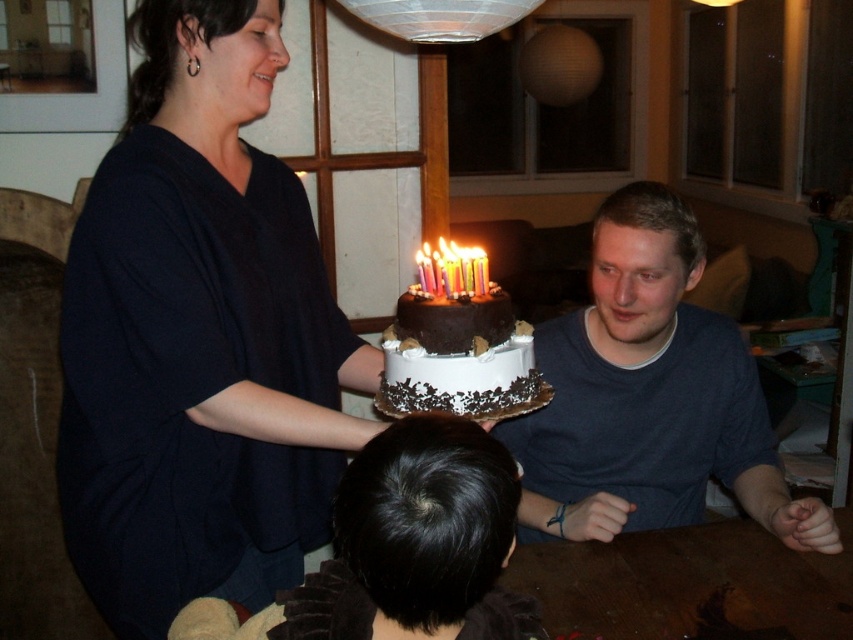
Based on the photo, is matte black dress at upper left closer to camera compared to brown wooden table at lower center?

Yes, matte black dress at upper left is closer to the viewer.

You are a GUI agent. You are given a task and a screenshot of the screen. Output one action in this format:
    pyautogui.click(x=<x>, y=<y>)
    Task: Click on the matte black dress at upper left
    The image size is (853, 640).
    Given the screenshot: What is the action you would take?
    pyautogui.click(x=199, y=339)

Is matte black dress at upper left behind chocolate frosted cake at center?

No, matte black dress at upper left is closer to the viewer.

Which is in front, point (223, 525) or point (445, 259)?

Point (445, 259) is in front.

This screenshot has height=640, width=853. Describe the element at coordinates (199, 339) in the screenshot. I see `matte black dress at upper left` at that location.

The image size is (853, 640). I want to click on matte black dress at upper left, so click(199, 339).

Who is positioned more to the right, matte black dress at upper left or matte dark blue shirt at center?

matte dark blue shirt at center

Can you confirm if matte black dress at upper left is positioned to the left of matte dark blue shirt at center?

Yes, matte black dress at upper left is to the left of matte dark blue shirt at center.

Who is more distant from viewer, (137, 506) or (733, 337)?

Positioned behind is point (733, 337).

This screenshot has width=853, height=640. Find the location of `matte black dress at upper left`. matte black dress at upper left is located at coordinates (199, 339).